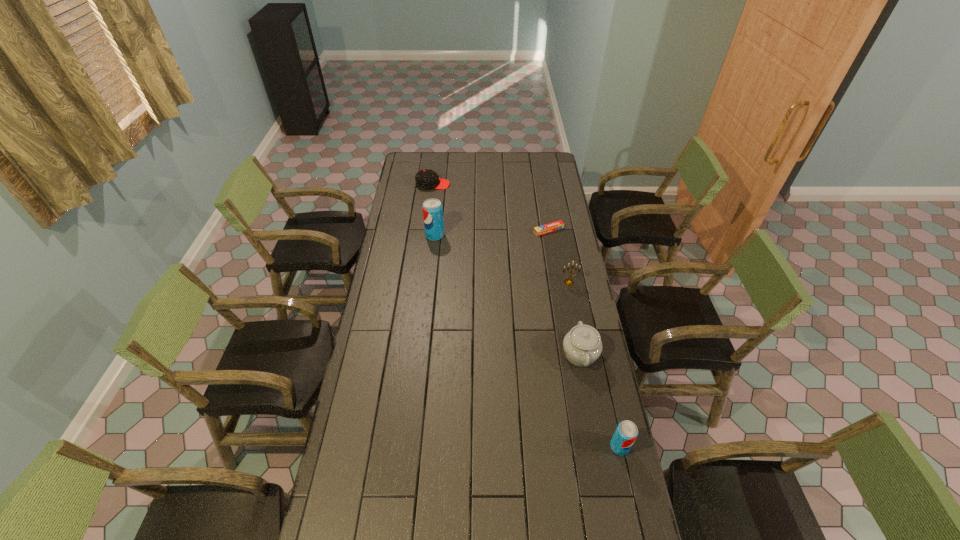
You are a GUI agent. You are given a task and a screenshot of the screen. Output one action in this format:
    pyautogui.click(x=<x>, y=<y>)
    Task: Click on the vacant region that satisfies the following two spatial constraints: 1. on the front-facing side of the second shortest object; 2. on the left side of the shortest object
    This screenshot has height=540, width=960.
    Given the screenshot: What is the action you would take?
    pyautogui.click(x=427, y=230)

The height and width of the screenshot is (540, 960). Find the location of `vacant space that satisfies the following two spatial constraints: 1. on the back side of the tallest object; 2. on the right side of the toothpaste`. vacant space that satisfies the following two spatial constraints: 1. on the back side of the tallest object; 2. on the right side of the toothpaste is located at coordinates (436, 230).